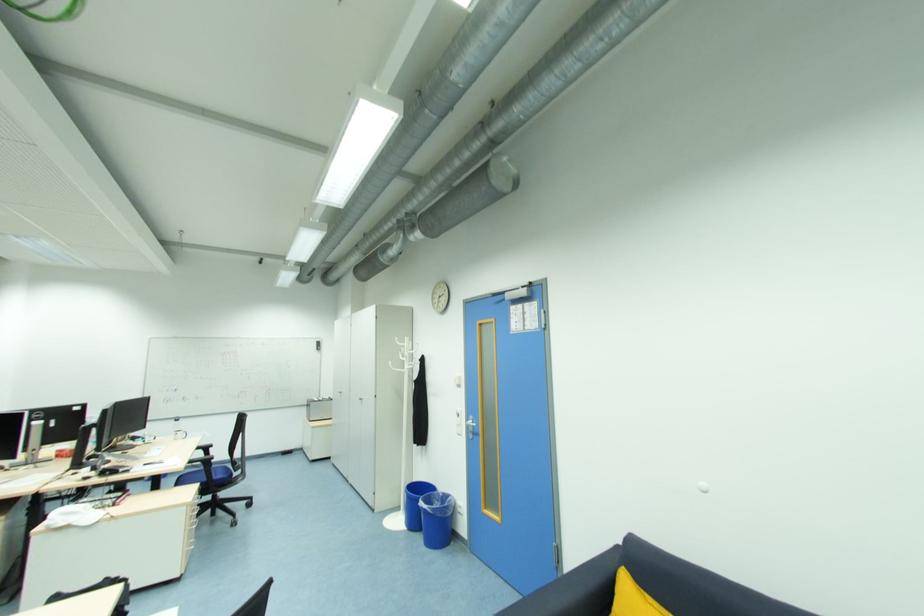
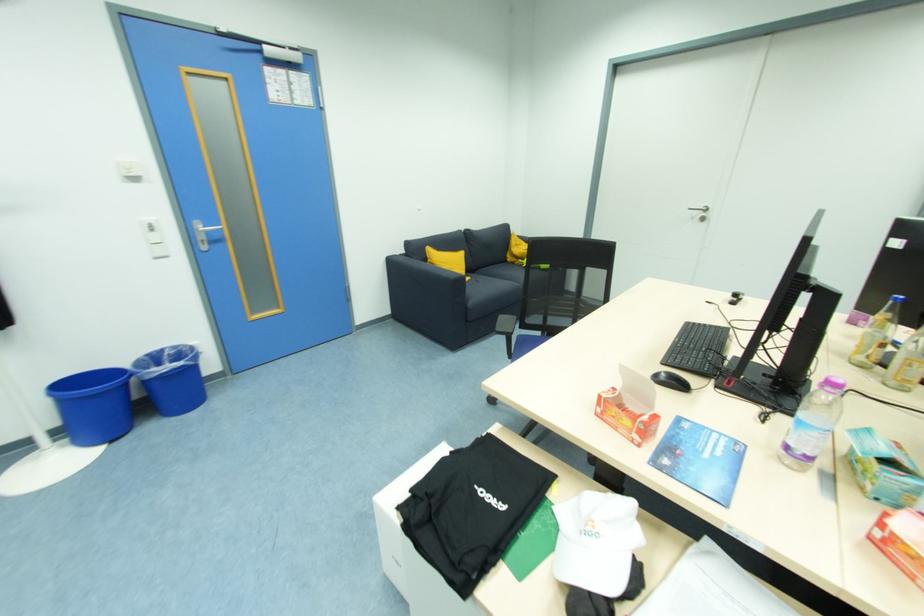
The point at (446,493) is marked in the first image. Where is the corresponding point in the second image?

(151, 357)